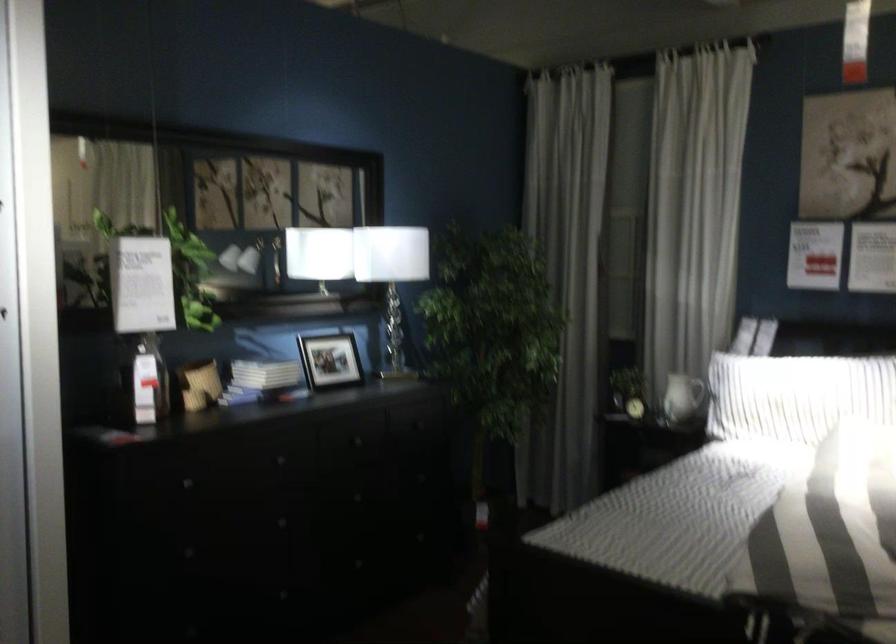
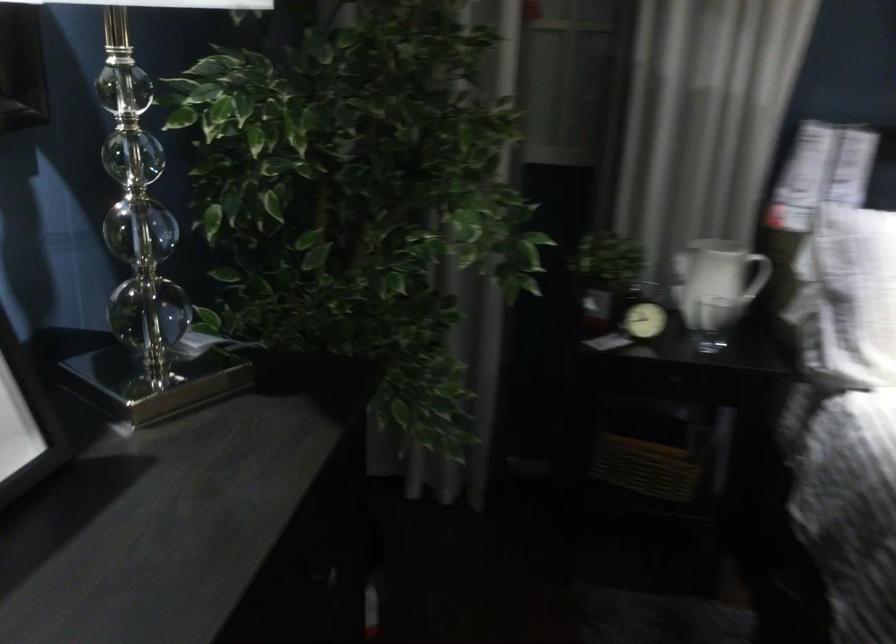
Find the pixel in the second image that matches (x=640, y=399) in the first image.

(643, 321)